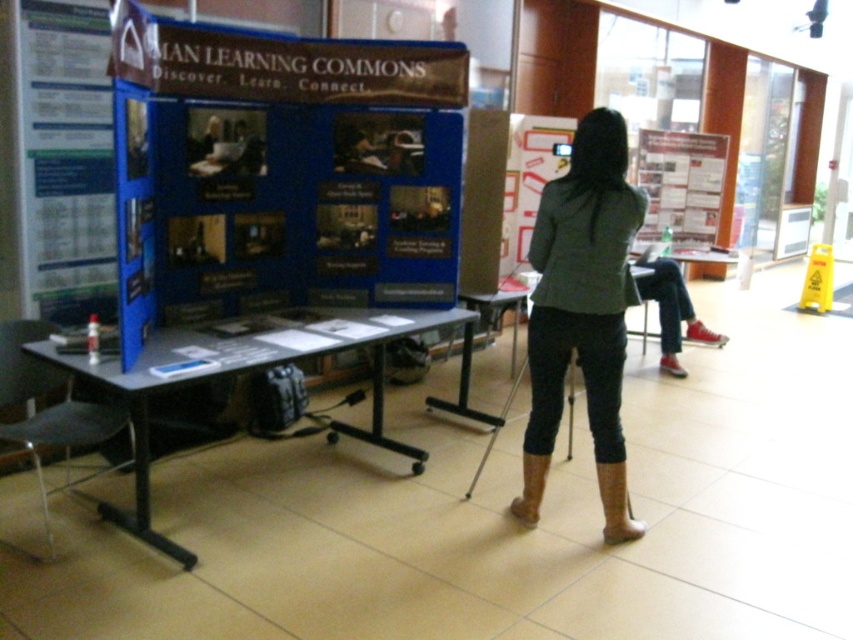
Question: Does metallic gray table at center have a greater width compared to matte paper poster at upper right?

Choices:
 (A) yes
 (B) no

Answer: (A)

Question: Is dark gray blazer at center to the right of matte paper poster at upper right from the viewer's perspective?

Choices:
 (A) no
 (B) yes

Answer: (A)

Question: Based on their relative distances, which object is farther from the matte paper poster at upper right?

Choices:
 (A) white paper poster at left
 (B) metallic gray table at center
 (C) dark gray blazer at center

Answer: (A)

Question: Which is nearer to the white paper poster at left?

Choices:
 (A) dark gray blazer at center
 (B) matte paper poster at upper right
 (C) metallic gray table at center

Answer: (C)

Question: Can you confirm if white paper poster at left is positioned above metallic gray table at center?

Choices:
 (A) no
 (B) yes

Answer: (B)

Question: Which of the following is the farthest from the observer?

Choices:
 (A) (569, 268)
 (B) (200, 339)

Answer: (B)